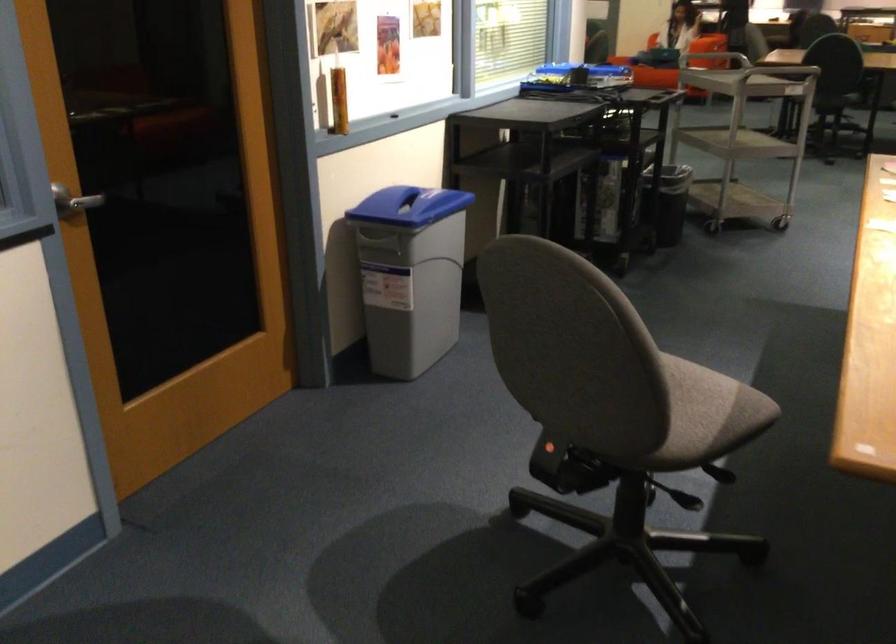
This screenshot has width=896, height=644. What do you see at coordinates (73, 201) in the screenshot? I see `a silver cart handle` at bounding box center [73, 201].